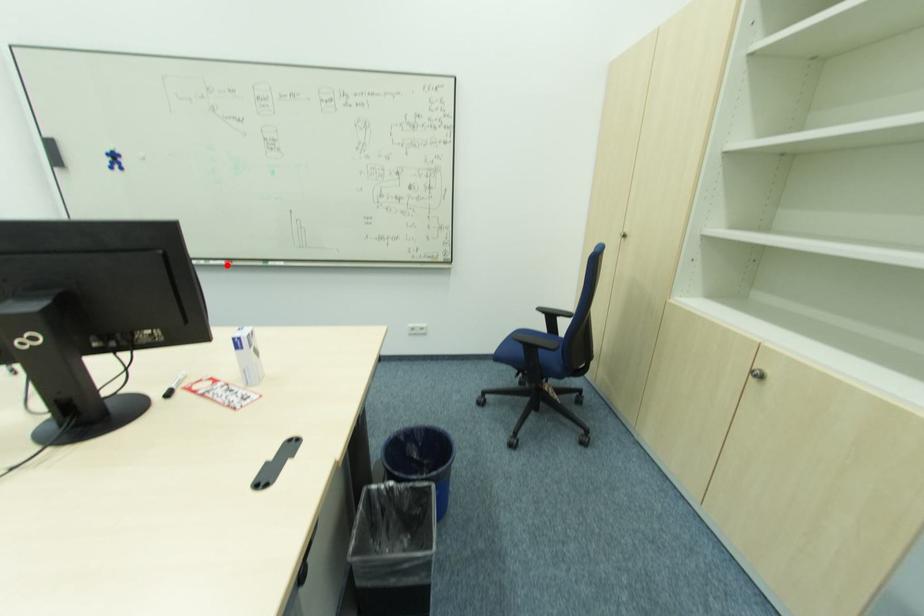
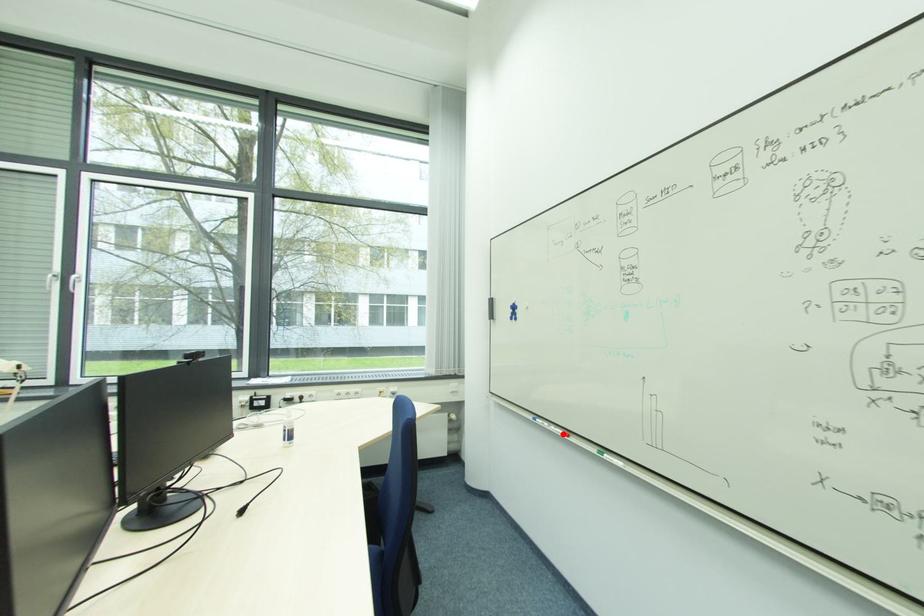
I am providing you with two images of the same scene from different viewpoints. A red point is marked on the first image and another point is marked on the second image. Do the highlighted points in image1 and image2 indicate the same real-world spot?

Yes